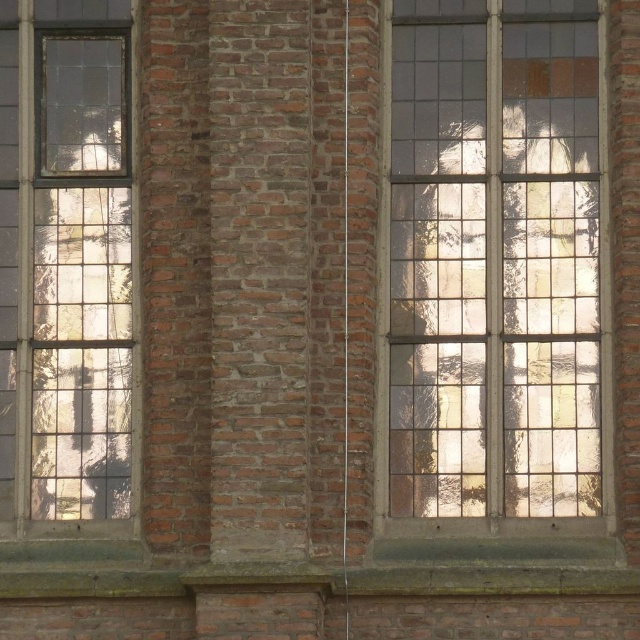
Question: Does stained glass window at center come in front of stained glass window at left?

Choices:
 (A) no
 (B) yes

Answer: (B)

Question: Which of the following is the closest to the observer?

Choices:
 (A) (22, 40)
 (B) (385, 93)

Answer: (B)

Question: Can you confirm if stained glass window at center is positioned to the right of stained glass window at left?

Choices:
 (A) yes
 (B) no

Answer: (A)

Question: Is stained glass window at center further to the viewer compared to stained glass window at left?

Choices:
 (A) yes
 (B) no

Answer: (B)

Question: Which point is closer to the camera taking this photo?

Choices:
 (A) (468, 349)
 (B) (115, 122)

Answer: (A)